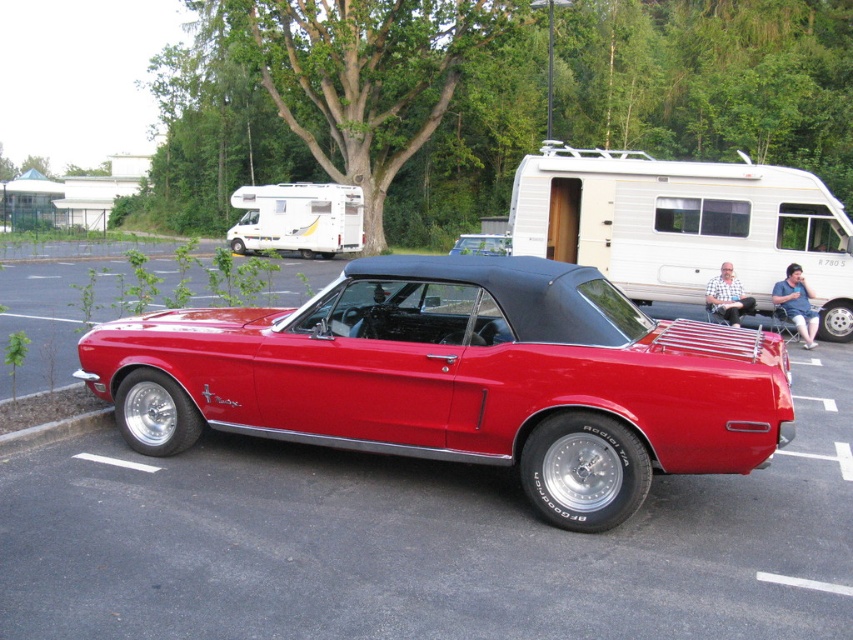
Does point (213, 420) come closer to viewer compared to point (648, 218)?

Yes, point (213, 420) is closer to viewer.

Where is `shiny red convertible at center`? shiny red convertible at center is located at coordinates (460, 378).